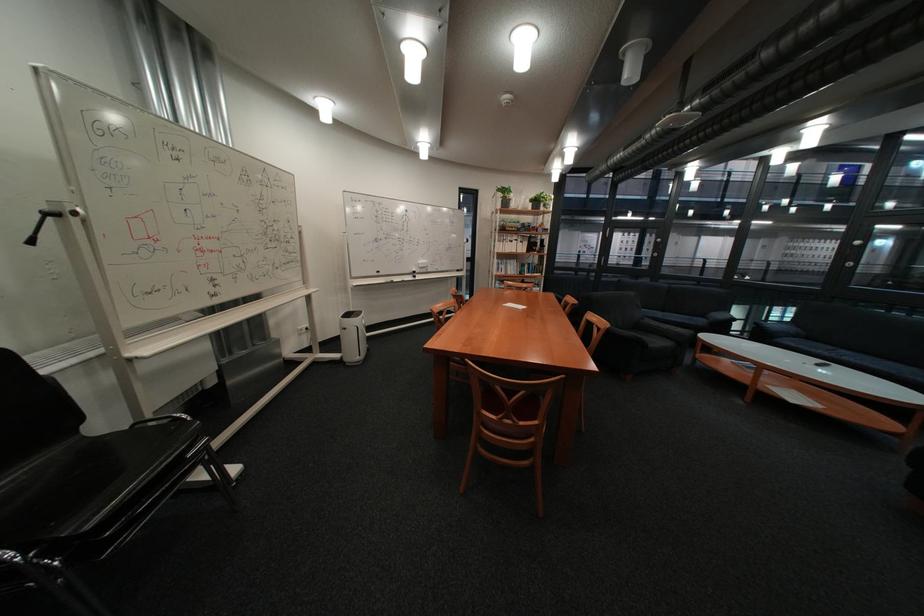
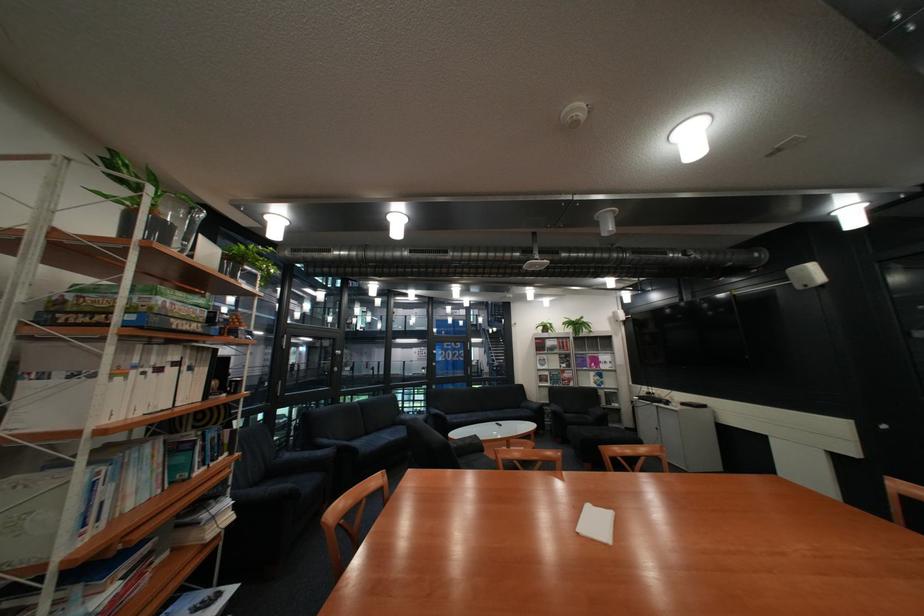
The point at (517, 243) is marked in the first image. Where is the corresponding point in the second image?

(134, 379)